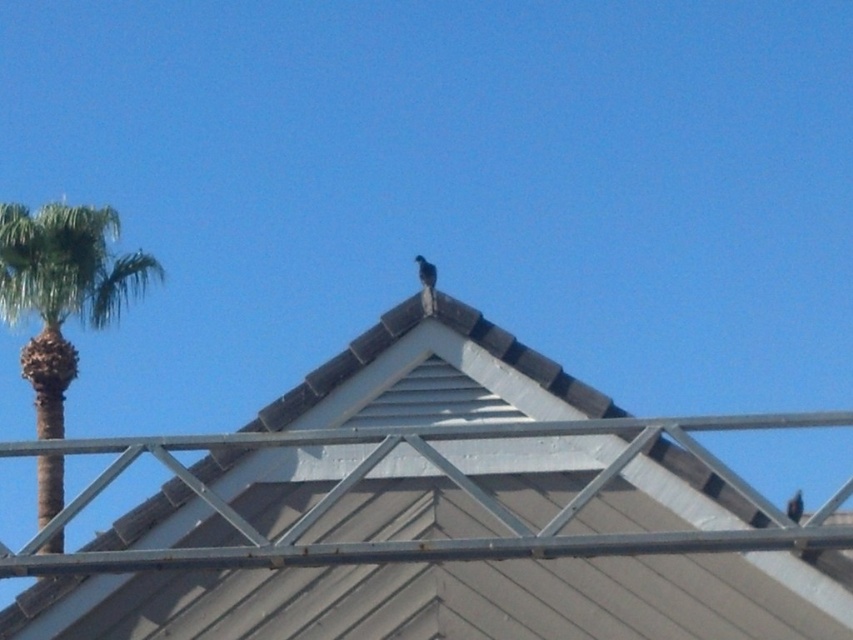
Question: Which object is the farthest from the dark brown feathered bird at upper center?

Choices:
 (A) green leafy palm tree at left
 (B) brown shingles at center

Answer: (A)

Question: Where is brown shingles at center located in relation to dark brown feathered bird at upper center in the image?

Choices:
 (A) above
 (B) below

Answer: (A)

Question: Does green leafy palm tree at left have a greater width compared to dark brown feathered bird at upper center?

Choices:
 (A) yes
 (B) no

Answer: (A)

Question: Which object is positioned farthest from the brown shingles at center?

Choices:
 (A) dark brown feathered bird at upper center
 (B) shiny blue bird at upper center
 (C) green leafy palm tree at left

Answer: (C)

Question: Can you confirm if brown shingles at center is positioned to the right of dark brown feathered bird at upper center?

Choices:
 (A) no
 (B) yes

Answer: (A)

Question: Which point is farther to the camera?

Choices:
 (A) shiny blue bird at upper center
 (B) dark brown feathered bird at upper center

Answer: (A)